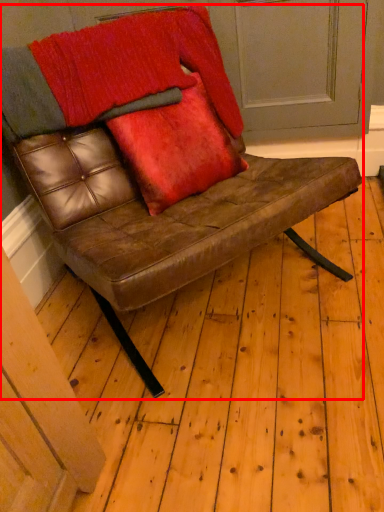
Question: Where is chair (annotated by the red box) located in relation to throw pillow in the image?

Choices:
 (A) left
 (B) right

Answer: (A)